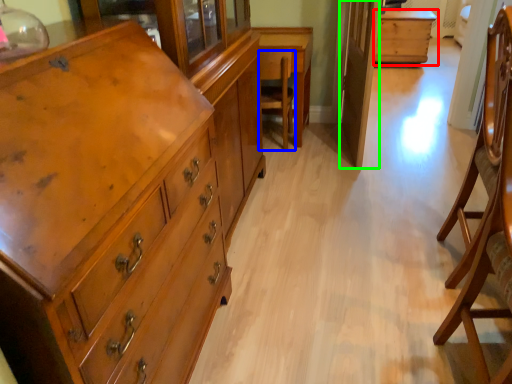
Question: Which object is positioned farthest from table (highlighted by a red box)? Select from armchair (highlighted by a blue box) and glass door (highlighted by a green box).

Choices:
 (A) armchair
 (B) glass door

Answer: (A)